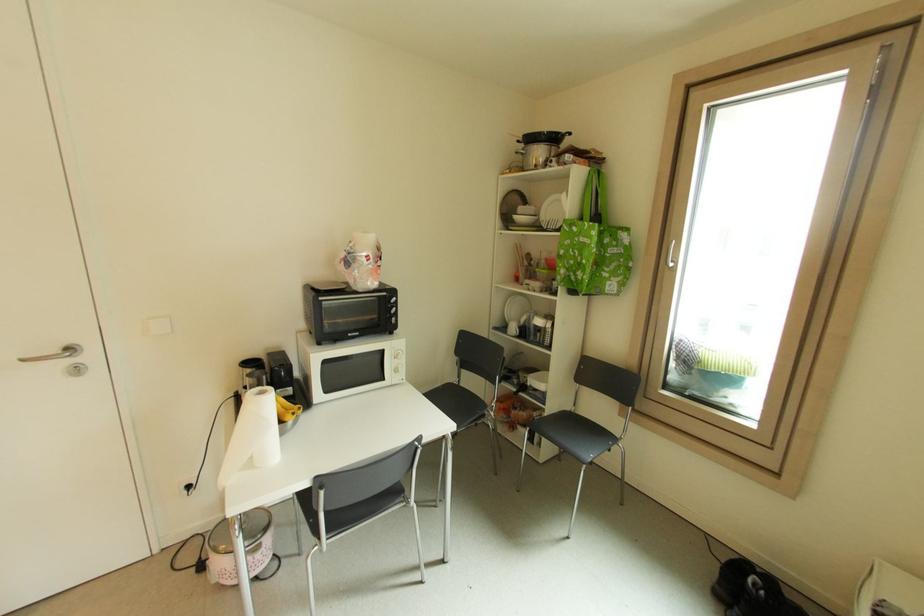
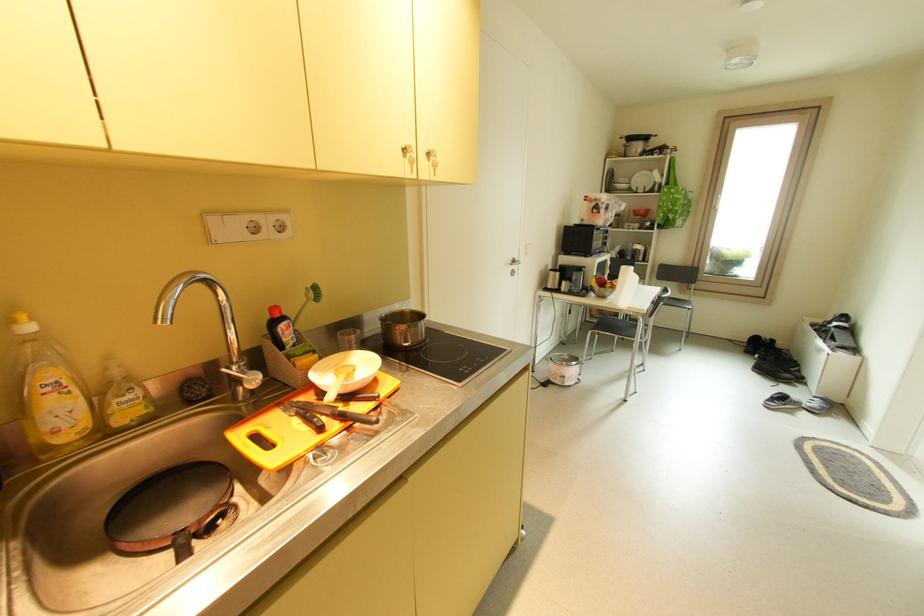
The point at (229, 578) is marked in the first image. Where is the corresponding point in the second image?

(578, 379)